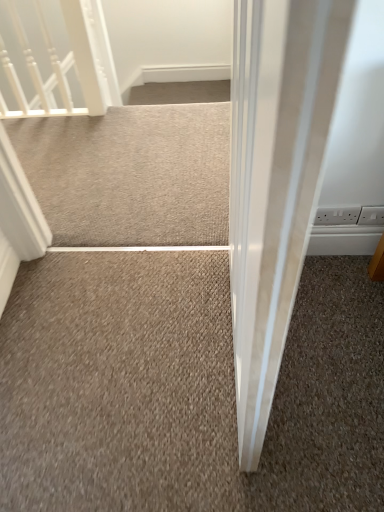
Question: Is white plastic electric outlet at upper right, which ranks as the 2th electric outlet in right-to-left order, at the back of beige carpet at center?

Choices:
 (A) no
 (B) yes

Answer: (A)

Question: Does beige carpet at center have a larger size compared to white plastic electric outlet at upper right, which ranks as the 2th electric outlet in right-to-left order?

Choices:
 (A) no
 (B) yes

Answer: (B)

Question: Is white plastic electric outlet at upper right, acting as the first electric outlet starting from the left, located within beige carpet at center?

Choices:
 (A) yes
 (B) no

Answer: (B)

Question: From the image's perspective, is beige carpet at center under white plastic electric outlet at upper right, acting as the first electric outlet starting from the left?

Choices:
 (A) no
 (B) yes

Answer: (A)

Question: Could you tell me if beige carpet at center is facing white plastic electric outlet at upper right, which ranks as the 2th electric outlet in right-to-left order?

Choices:
 (A) no
 (B) yes

Answer: (A)

Question: Based on their positions, is white plastic electric outlet at right, which is the 1th electric outlet from right to left, located to the left or right of beige carpet at center?

Choices:
 (A) right
 (B) left

Answer: (A)

Question: From their relative heights in the image, would you say white plastic electric outlet at right, which is the 1th electric outlet from right to left, is taller or shorter than beige carpet at center?

Choices:
 (A) short
 (B) tall

Answer: (B)

Question: Considering the positions of white plastic electric outlet at right, the 2th electric outlet from the left, and beige carpet at center in the image, is white plastic electric outlet at right, the 2th electric outlet from the left, bigger or smaller than beige carpet at center?

Choices:
 (A) big
 (B) small

Answer: (B)

Question: Is white plastic electric outlet at right, which is the 1th electric outlet from right to left, situated inside beige carpet at center or outside?

Choices:
 (A) outside
 (B) inside

Answer: (A)

Question: Is beige carpet at center in front of or behind white glossy rail at upper left in the image?

Choices:
 (A) front
 (B) behind

Answer: (A)

Question: Looking at their shapes, would you say beige carpet at center is wider or thinner than white glossy rail at upper left?

Choices:
 (A) wide
 (B) thin

Answer: (A)

Question: Does point (223, 145) appear closer or farther from the camera than point (18, 33)?

Choices:
 (A) closer
 (B) farther

Answer: (A)

Question: From their relative heights in the image, would you say beige carpet at center is taller or shorter than white glossy rail at upper left?

Choices:
 (A) short
 (B) tall

Answer: (A)

Question: Relative to white plastic electric outlet at right, which is the 1th electric outlet from right to left, is beige carpet at center in front or behind?

Choices:
 (A) behind
 (B) front

Answer: (A)

Question: Is beige carpet at center taller or shorter than white plastic electric outlet at right, which is the 1th electric outlet from right to left?

Choices:
 (A) tall
 (B) short

Answer: (B)